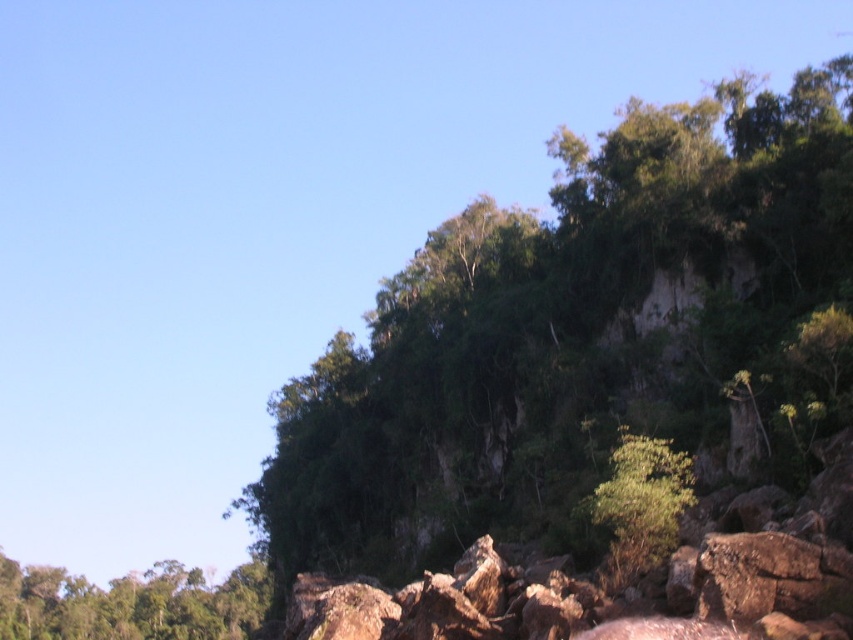
Question: Does green leafy tree at lower left have a larger size compared to green leafy tree at center?

Choices:
 (A) no
 (B) yes

Answer: (B)

Question: Does green leafy tree at lower left have a greater width compared to green leafy tree at center?

Choices:
 (A) no
 (B) yes

Answer: (B)

Question: Which point appears closest to the camera in this image?

Choices:
 (A) (686, 508)
 (B) (67, 579)
 (C) (613, 365)

Answer: (A)

Question: Can you confirm if green leafy tree at upper center is positioned above green leafy tree at lower left?

Choices:
 (A) no
 (B) yes

Answer: (B)

Question: Estimate the real-world distances between objects in this image. Which object is farther from the green leafy tree at upper center?

Choices:
 (A) green leafy tree at lower left
 (B) green leafy tree at center

Answer: (A)

Question: Which is nearer to the green leafy tree at center?

Choices:
 (A) green leafy tree at lower left
 (B) green leafy tree at upper center

Answer: (B)